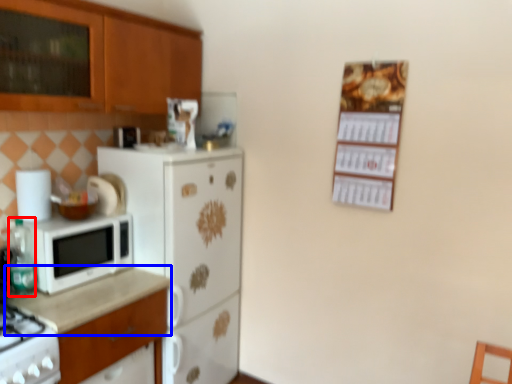
Question: Which object is further to the camera taking this photo, bottle (highlighted by a red box) or countertop (highlighted by a blue box)?

Choices:
 (A) bottle
 (B) countertop

Answer: (A)